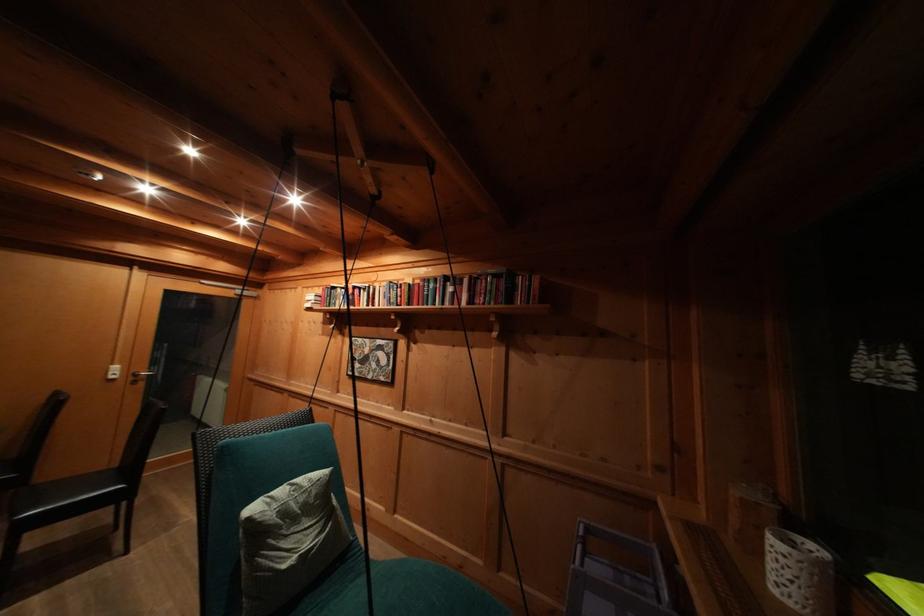
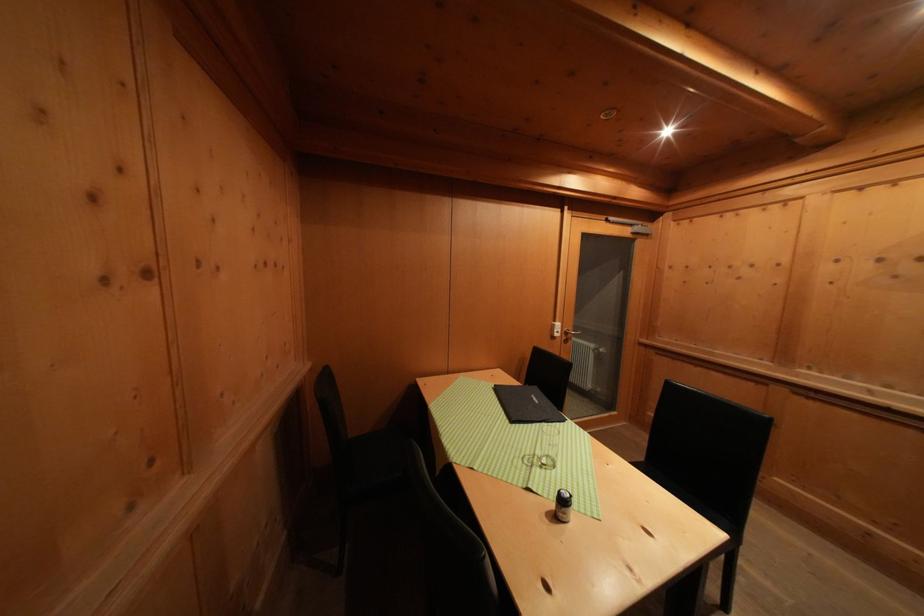
In the second image, find the point that corresponds to (x=122, y=371) in the first image.

(564, 330)